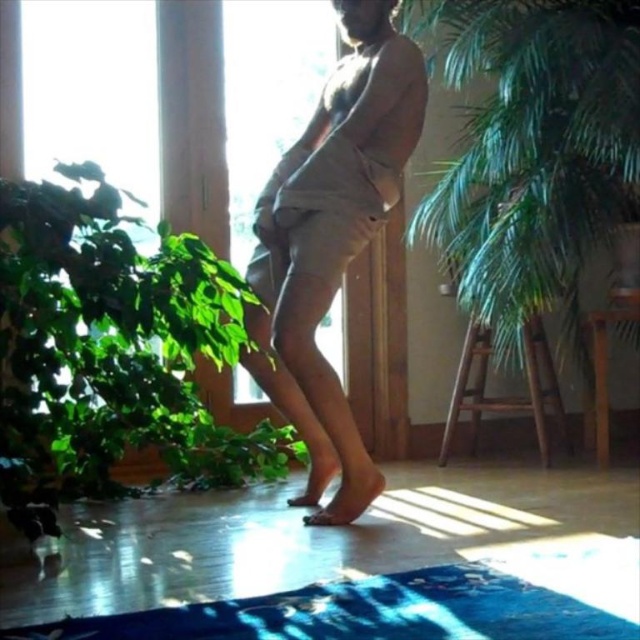
Does green leafy plant at lower left have a smaller size compared to beige cotton shorts at center?

No, green leafy plant at lower left is not smaller than beige cotton shorts at center.

Does green leafy plant at lower left lie behind beige cotton shorts at center?

No.

This screenshot has width=640, height=640. In order to click on green leafy plant at lower left in this screenshot , I will do `click(112, 353)`.

The width and height of the screenshot is (640, 640). Find the location of `green leafy plant at lower left`. green leafy plant at lower left is located at coordinates (112, 353).

Does beige cotton shorts at center have a larger size compared to blue textured yoga mat at lower center?

Yes, beige cotton shorts at center is bigger than blue textured yoga mat at lower center.

Between point (317, 509) and point (492, 586), which one is positioned in front?

Point (492, 586) is more forward.

Who is more forward, (394, 200) or (141, 627)?

Positioned in front is point (141, 627).

This screenshot has height=640, width=640. I want to click on beige cotton shorts at center, so click(x=332, y=243).

Who is higher up, green leafy plant at lower left or transparent glass window at center?

transparent glass window at center is above.

Which of these two, green leafy plant at lower left or transparent glass window at center, stands shorter?

Standing shorter between the two is green leafy plant at lower left.

Is point (52, 266) closer to camera compared to point (292, 36)?

Yes, point (52, 266) is closer to viewer.

Where is `green leafy plant at lower left`? green leafy plant at lower left is located at coordinates (112, 353).